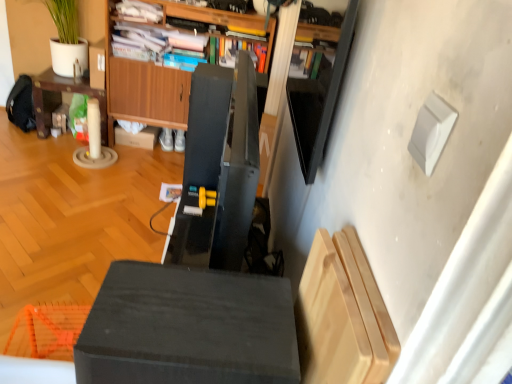
You are a GUI agent. You are given a task and a screenshot of the screen. Output one action in this format:
    pyautogui.click(x=<x>, y=<y>)
    Task: Click on the free location in front of brown cardboard box at center
    
    Given the screenshot: What is the action you would take?
    pyautogui.click(x=138, y=158)